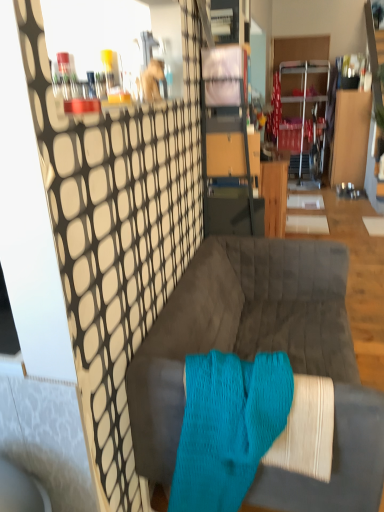
Describe the element at coordinates (274, 196) in the screenshot. I see `wooden table at center` at that location.

What are the coordinates of `velvet gray couch at center` in the screenshot? It's located at (254, 356).

Would you say aqua knitted sock at center is inside or outside wooden table at center?

aqua knitted sock at center exists outside the volume of wooden table at center.

Considering the points (254, 420) and (280, 212), which point is in front, point (254, 420) or point (280, 212)?

The point (254, 420) is closer.

How different are the orientations of aqua knitted sock at center and wooden table at center in degrees?

They differ by 90.7 degrees in their facing directions.

Which object is positioned more to the left, aqua knitted sock at center or wooden table at center?

From the viewer's perspective, aqua knitted sock at center appears more on the left side.

Does wooden table at center turn towards aqua knitted sock at center?

No, wooden table at center is not turned towards aqua knitted sock at center.

Between point (278, 186) and point (270, 416), which one is positioned in front?

The point (270, 416) is in front.

Does wooden table at center have a lesser height compared to aqua knitted sock at center?

In fact, wooden table at center may be taller than aqua knitted sock at center.

Based on the photo, from a real-world perspective, which object rests below the other?

wooden table at center, from a real-world perspective.

Can you confirm if aqua knitted sock at center is taller than velvet gray couch at center?

No.

From the picture: From a real-world perspective, is aqua knitted sock at center above or below velvet gray couch at center?

From a real-world perspective, aqua knitted sock at center is physically above velvet gray couch at center.

Is aqua knitted sock at center smaller than velvet gray couch at center?

Yes, aqua knitted sock at center is smaller than velvet gray couch at center.

Is aqua knitted sock at center not near velvet gray couch at center?

No, there isn't a large distance between aqua knitted sock at center and velvet gray couch at center.

Consider the image. Considering the sizes of objects velvet gray couch at center and aqua knitted sock at center in the image provided, who is shorter, velvet gray couch at center or aqua knitted sock at center?

aqua knitted sock at center.

Would you say velvet gray couch at center contains aqua knitted sock at center?

Indeed, aqua knitted sock at center is located within velvet gray couch at center.

Is velvet gray couch at center placed right next to aqua knitted sock at center?

No, velvet gray couch at center is not with aqua knitted sock at center.

In the image, there is a velvet gray couch at center. Identify the location of table above it (from the image's perspective). This screenshot has width=384, height=512. (274, 196).

From the image's perspective, which one is positioned higher, velvet gray couch at center or wooden table at center?

wooden table at center, from the image's perspective.

Which is less distant, (374, 421) or (282, 230)?

Point (374, 421).

Considering their positions, is wooden table at center located in front of or behind velvet gray couch at center?

Clearly, wooden table at center is behind velvet gray couch at center.

Is wooden table at center facing away from velvet gray couch at center?

wooden table at center does not have its back to velvet gray couch at center.

Is wooden table at center not close to velvet gray couch at center?

Yes, wooden table at center is far from velvet gray couch at center.

Locate an element on the screen. table that appears below the aqua knitted sock at center (from a real-world perspective) is located at coordinates (274, 196).

The width and height of the screenshot is (384, 512). In order to click on aqua that is on the left side of wooden table at center in this screenshot , I will do `click(228, 426)`.

Estimate the real-world distances between objects in this image. Which object is further from velvet gray couch at center, wooden table at center or aqua knitted sock at center?

wooden table at center.

Estimate the real-world distances between objects in this image. Which object is further from wooden table at center, aqua knitted sock at center or velvet gray couch at center?

Based on the image, aqua knitted sock at center appears to be further to wooden table at center.

In the scene shown: From the image, which object appears to be nearer to aqua knitted sock at center, velvet gray couch at center or wooden table at center?

velvet gray couch at center is closer to aqua knitted sock at center.

Estimate the real-world distances between objects in this image. Which object is further from aqua knitted sock at center, wooden table at center or velvet gray couch at center?

wooden table at center.

When comparing their distances from wooden table at center, does velvet gray couch at center or aqua knitted sock at center seem further?

Based on the image, aqua knitted sock at center appears to be further to wooden table at center.

Estimate the real-world distances between objects in this image. Which object is closer to velvet gray couch at center, aqua knitted sock at center or wooden table at center?

The object closer to velvet gray couch at center is aqua knitted sock at center.

Image resolution: width=384 pixels, height=512 pixels. Identify the location of studio couch positioned between aqua knitted sock at center and wooden table at center from near to far. (254, 356).